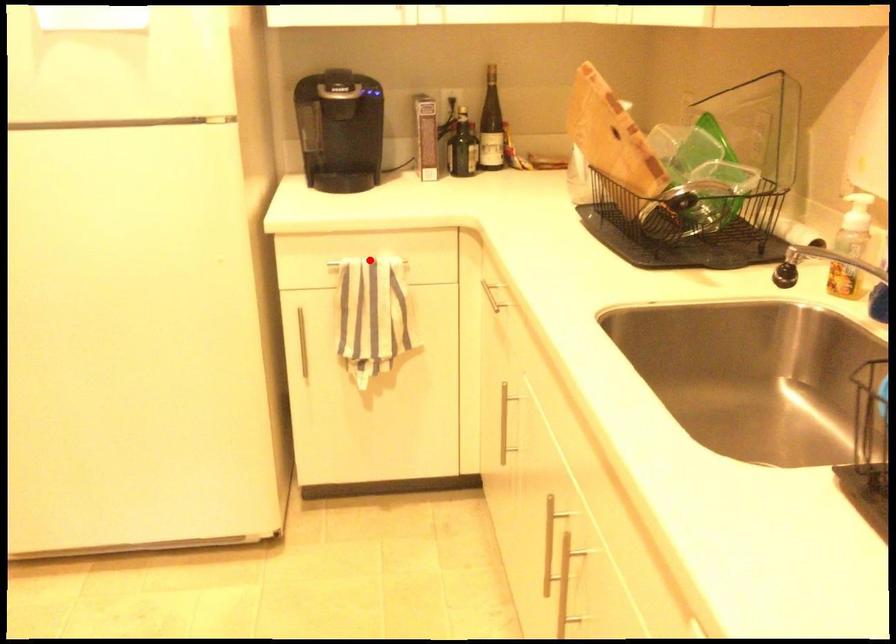
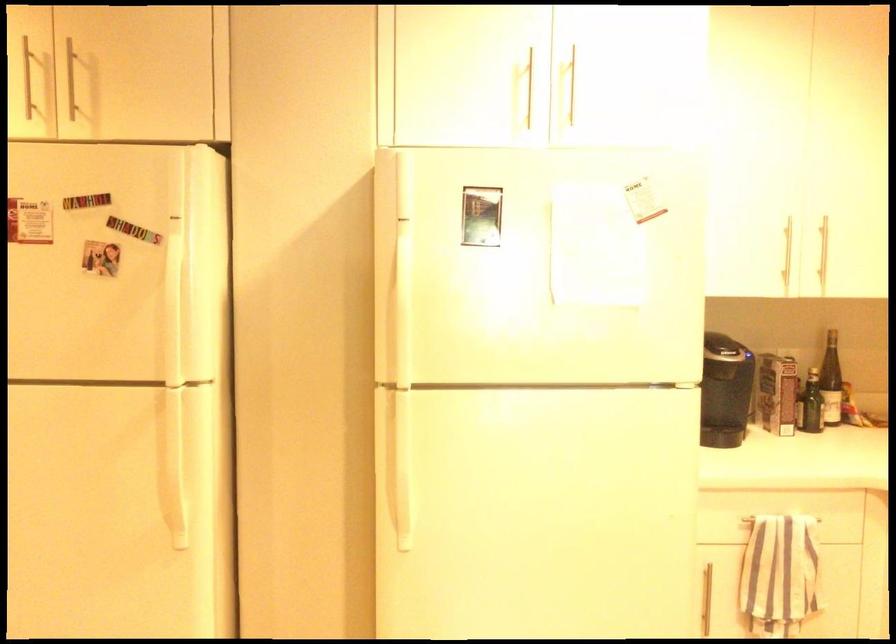
Find the pixel in the second image that matches the highlighted location in the first image.

(781, 518)